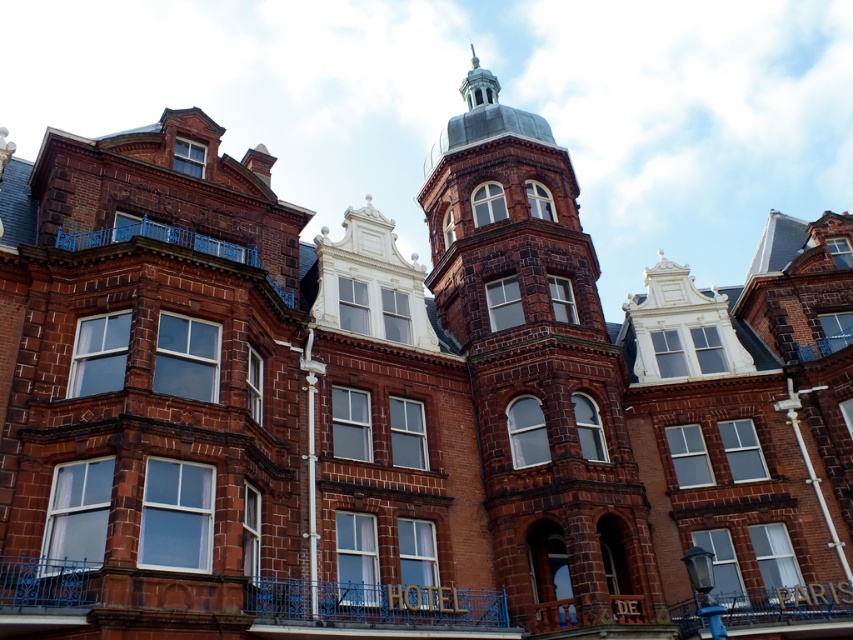
Question: Does smooth brick bell tower at center have a larger size compared to polished silver spire at upper center?

Choices:
 (A) yes
 (B) no

Answer: (B)

Question: Does smooth brick bell tower at center appear on the right side of polished silver spire at upper center?

Choices:
 (A) yes
 (B) no

Answer: (B)

Question: Can you confirm if smooth brick bell tower at center is positioned below polished silver spire at upper center?

Choices:
 (A) no
 (B) yes

Answer: (B)